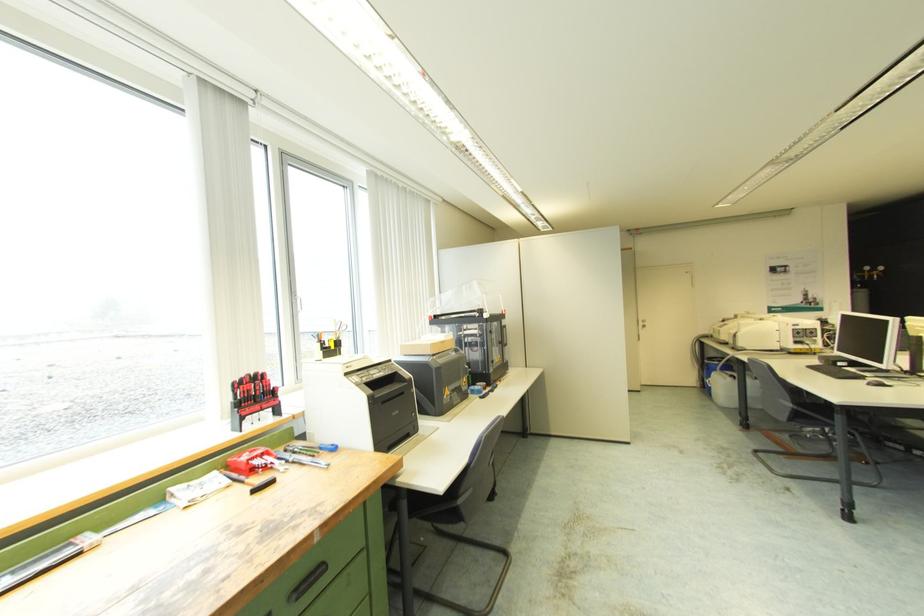
This screenshot has width=924, height=616. What do you see at coordinates (487, 309) in the screenshot?
I see `the printer scanner lid` at bounding box center [487, 309].